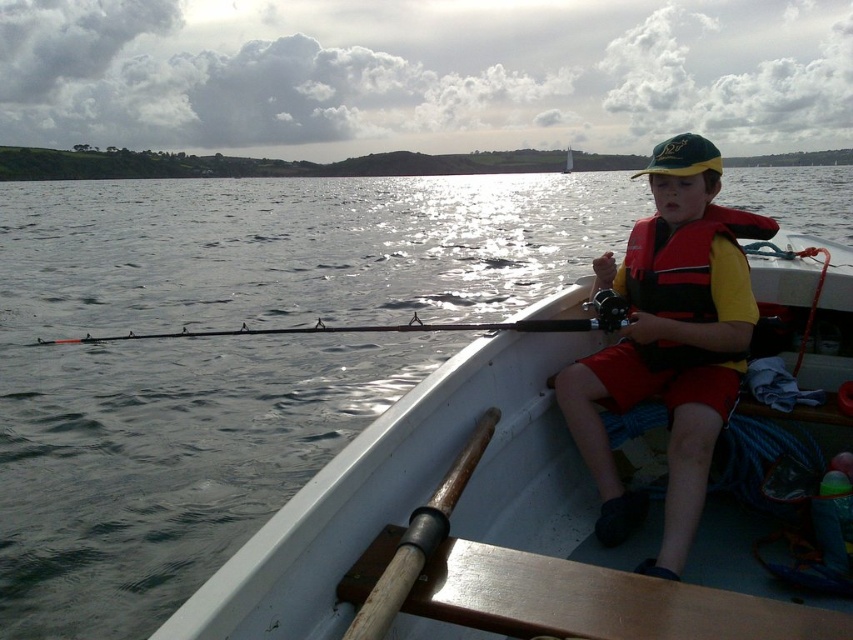
Question: Considering the relative positions of white plastic boat at center and matte orange life vest at center in the image provided, where is white plastic boat at center located with respect to matte orange life vest at center?

Choices:
 (A) above
 (B) below

Answer: (B)

Question: Does matte orange life vest at center have a larger size compared to red nylon life jacket at center?

Choices:
 (A) yes
 (B) no

Answer: (A)

Question: Based on their relative distances, which object is nearer to the matte orange life vest at center?

Choices:
 (A) red nylon life jacket at center
 (B) white plastic boat at center

Answer: (A)

Question: Considering the real-world distances, which object is closest to the white plastic boat at center?

Choices:
 (A) red nylon life jacket at center
 (B) matte orange life vest at center

Answer: (B)

Question: Which of the following is the closest to the observer?

Choices:
 (A) [666, 308]
 (B) [672, 310]

Answer: (B)

Question: In this image, where is white plastic boat at center located relative to matte orange life vest at center?

Choices:
 (A) below
 (B) above

Answer: (A)